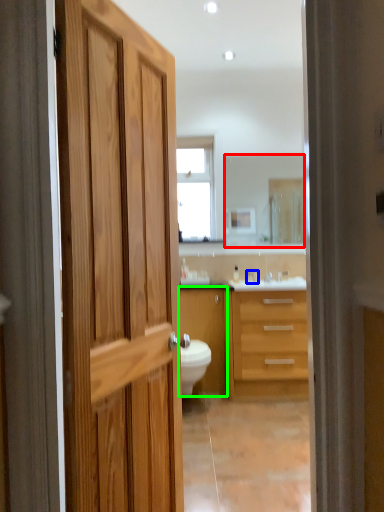
Question: Which is nearer to the mirror (highlighted by a red box)? faucet (highlighted by a blue box) or cabinetry (highlighted by a green box).

Choices:
 (A) faucet
 (B) cabinetry

Answer: (A)